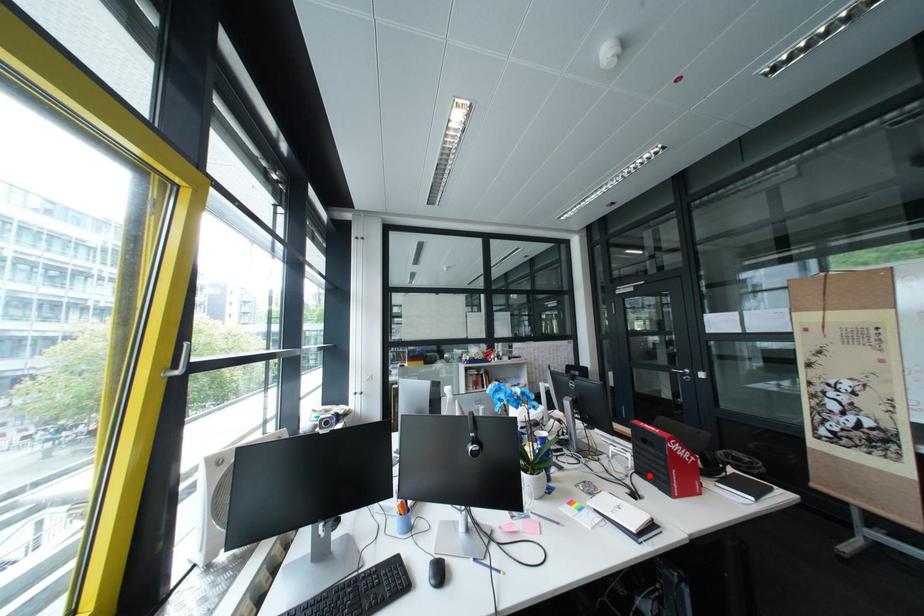
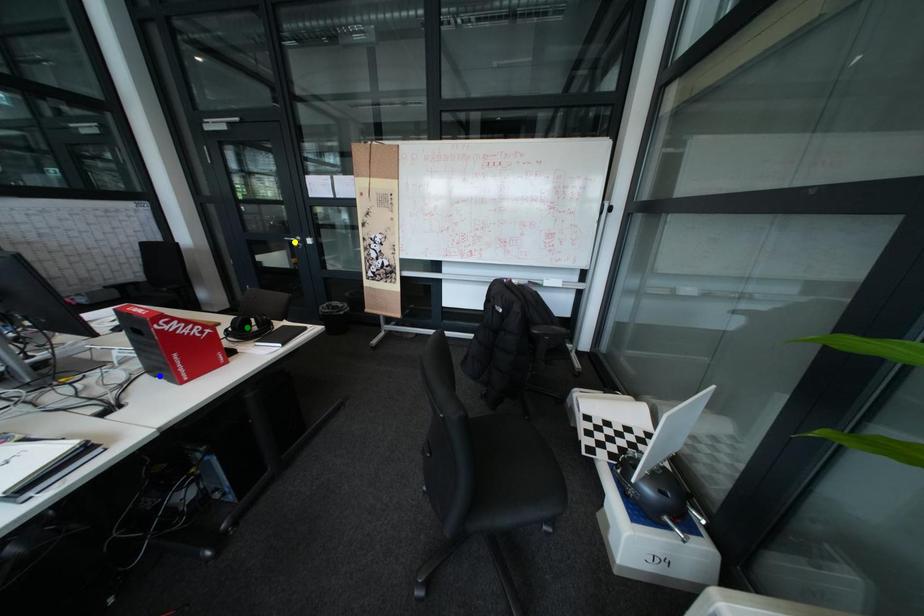
Question: I am providing you with two images of the same scene from different viewpoints. A red point is marked on the first image. You are given multiple points on the second image. Which spot in image 2 lines up with the point in image 1?

Choices:
 (A) blue point
 (B) green point
 (C) yellow point

Answer: (A)